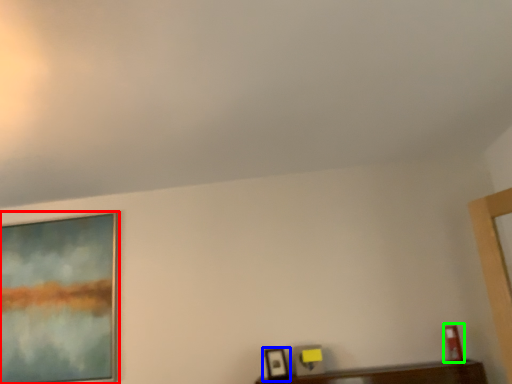
Question: Which is nearer to the picture frame (highlighted by a red box)? picture frame (highlighted by a blue box) or picture frame (highlighted by a green box).

Choices:
 (A) picture frame
 (B) picture frame

Answer: (A)